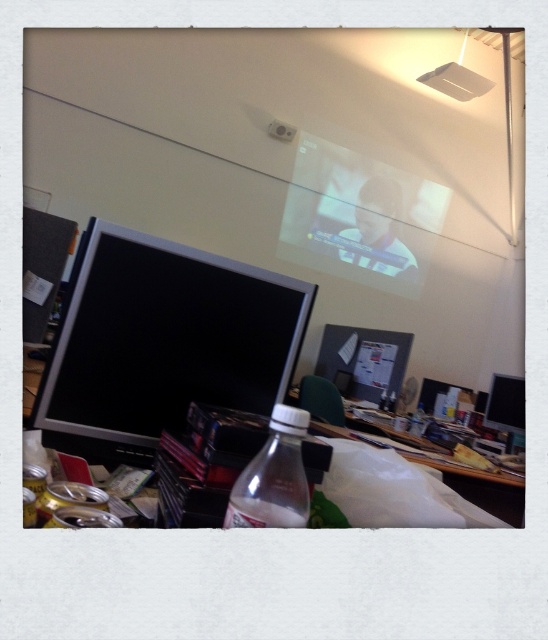
Is translucent plastic table at center behind black glossy monitor at right?

No, translucent plastic table at center is in front of black glossy monitor at right.

Is translucent plastic table at center wider than black glossy monitor at right?

Correct, the width of translucent plastic table at center exceeds that of black glossy monitor at right.

Between point (425, 445) and point (520, 404), which one is positioned in front?

Point (425, 445) is in front.

Locate an element on the screen. The width and height of the screenshot is (548, 640). translucent plastic table at center is located at coordinates (482, 486).

Does point (191, 324) lie in front of point (284, 412)?

No, (191, 324) is behind (284, 412).

Does point (179, 358) come behind point (231, 524)?

That is True.

Where is `satin black monitor at center`? satin black monitor at center is located at coordinates (162, 342).

How much distance is there between satin black monitor at center and black glossy monitor at right?

A distance of 2.91 meters exists between satin black monitor at center and black glossy monitor at right.

Does satin black monitor at center lie behind black glossy monitor at right?

No, satin black monitor at center is in front of black glossy monitor at right.

Which is behind, point (146, 400) or point (498, 384)?

The point (498, 384) is more distant.

Find the location of `satin black monitor at center`. satin black monitor at center is located at coordinates (162, 342).